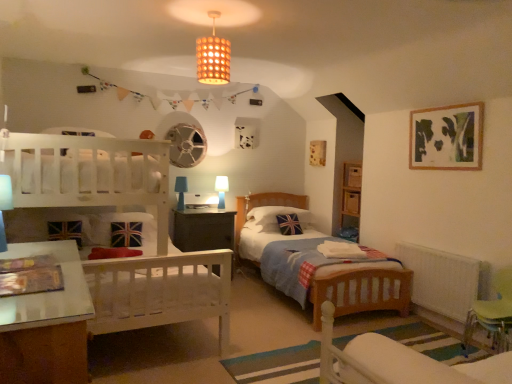
Question: From a real-world perspective, is white plastic radiator at lower right under blue fabric table lamp at center, marked as the 1th table lamp in a left-to-right arrangement?

Choices:
 (A) no
 (B) yes

Answer: (B)

Question: Can you confirm if white plastic radiator at lower right is thinner than blue fabric table lamp at center, placed as the second table lamp when sorted from back to front?

Choices:
 (A) yes
 (B) no

Answer: (A)

Question: From the image's perspective, is white plastic radiator at lower right above blue fabric table lamp at center, placed as the second table lamp when sorted from back to front?

Choices:
 (A) no
 (B) yes

Answer: (A)

Question: Can you confirm if white plastic radiator at lower right is smaller than blue fabric table lamp at center, the second table lamp in the right-to-left sequence?

Choices:
 (A) yes
 (B) no

Answer: (B)

Question: Can you confirm if white plastic radiator at lower right is positioned to the right of blue fabric table lamp at center, the second table lamp in the right-to-left sequence?

Choices:
 (A) no
 (B) yes

Answer: (B)

Question: Would you say white plastic radiator at lower right is a long distance from blue fabric table lamp at center, the second table lamp in the right-to-left sequence?

Choices:
 (A) yes
 (B) no

Answer: (A)

Question: Is dark wood nightstand at center further to the viewer compared to matte brown lampshade at upper center?

Choices:
 (A) no
 (B) yes

Answer: (A)

Question: Can you confirm if dark wood nightstand at center is taller than matte brown lampshade at upper center?

Choices:
 (A) no
 (B) yes

Answer: (B)

Question: Is dark wood nightstand at center bigger than matte brown lampshade at upper center?

Choices:
 (A) no
 (B) yes

Answer: (B)

Question: Is dark wood nightstand at center shorter than matte brown lampshade at upper center?

Choices:
 (A) no
 (B) yes

Answer: (A)

Question: Is dark wood nightstand at center next to matte brown lampshade at upper center?

Choices:
 (A) no
 (B) yes

Answer: (A)

Question: Considering the relative sizes of dark wood nightstand at center and matte brown lampshade at upper center in the image provided, is dark wood nightstand at center thinner than matte brown lampshade at upper center?

Choices:
 (A) yes
 (B) no

Answer: (B)

Question: Are green plastic swivel chair at lower right, the 2th swivel chair when ordered from front to back, and white wooden bunk bed at left located far from each other?

Choices:
 (A) yes
 (B) no

Answer: (A)